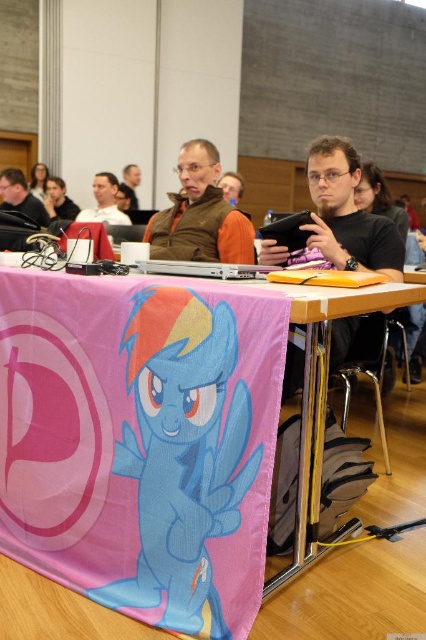
Question: Estimate the real-world distances between objects in this image. Which object is farther from the matte brown jacket at center?

Choices:
 (A) matte black tablet at center
 (B) matte black laptop at left
 (C) white matte shirt at upper center
 (D) brown fuzzy vest at center

Answer: (A)

Question: Is matte black tablet at center further to camera compared to white matte shirt at upper center?

Choices:
 (A) yes
 (B) no

Answer: (B)

Question: Which of the following is the closest to the observer?

Choices:
 (A) (131, 166)
 (B) (103, 216)

Answer: (B)

Question: Estimate the real-world distances between objects in this image. Which object is closer to the matte brown jacket at center?

Choices:
 (A) matte black tablet at center
 (B) brown fuzzy vest at center
 (C) white matte shirt at upper center

Answer: (C)

Question: Is brown fuzzy vest at center in front of matte black laptop at left?

Choices:
 (A) no
 (B) yes

Answer: (B)

Question: From the image, what is the correct spatial relationship of brown fuzzy vest at center in relation to matte brown jacket at center?

Choices:
 (A) right
 (B) left

Answer: (A)